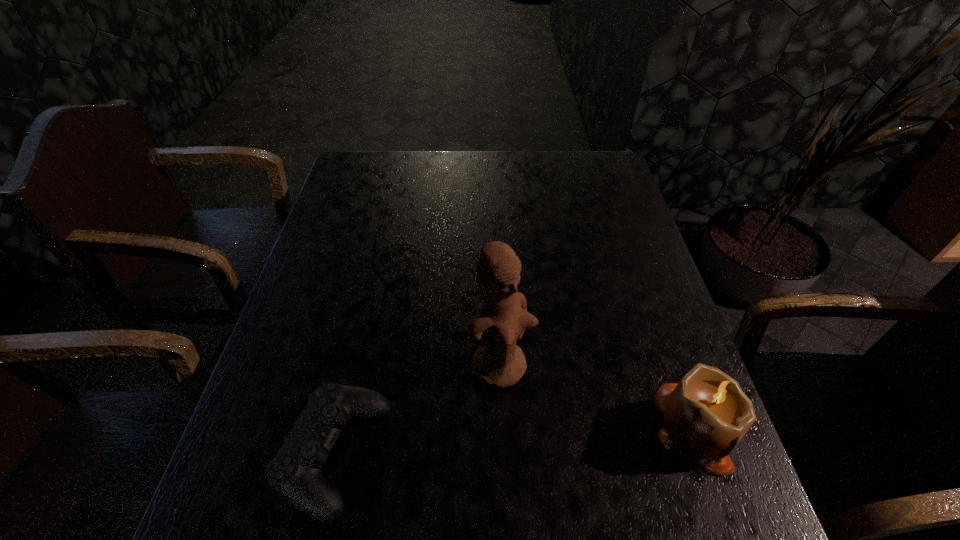
Where is `free space on the desktop that is between the control and the candle and is positioned on the front-facing side of the farthest object`? The height and width of the screenshot is (540, 960). free space on the desktop that is between the control and the candle and is positioned on the front-facing side of the farthest object is located at coordinates (531, 440).

The width and height of the screenshot is (960, 540). In order to click on vacant space on the desktop that is between the second shortest object and the third shortest object and is positioned on the front-facing side of the third object from left to right in this screenshot , I will do `click(570, 437)`.